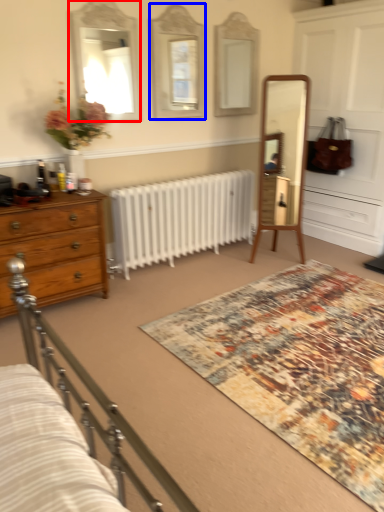
Question: Among these objects, which one is farthest to the camera, mirror (highlighted by a red box) or mirror (highlighted by a blue box)?

Choices:
 (A) mirror
 (B) mirror

Answer: (B)